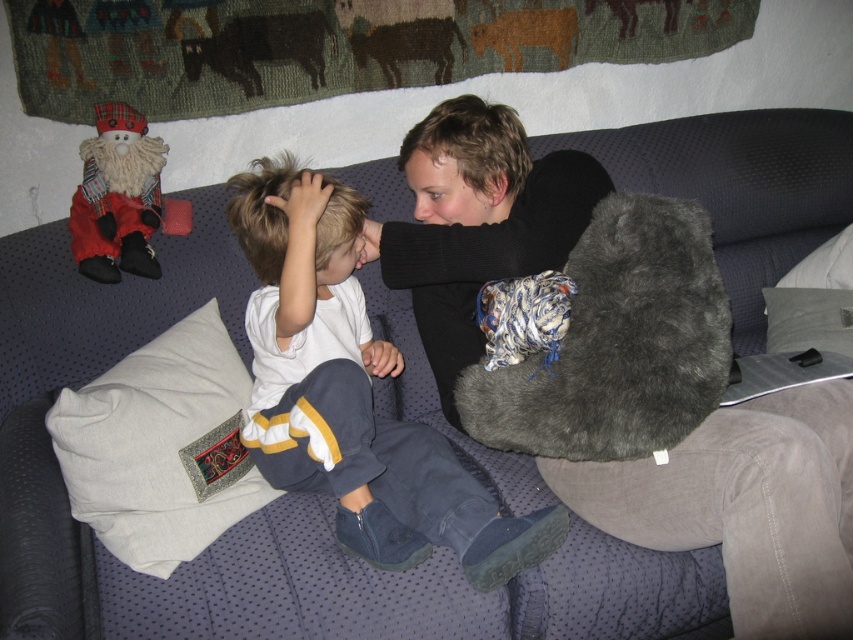
Question: Does fuzzy gray pillow at center lie behind white cotton pillow at lower left?

Choices:
 (A) yes
 (B) no

Answer: (B)

Question: Estimate the real-world distances between objects in this image. Which object is closer to the white cotton shirt at center?

Choices:
 (A) fuzzy gray pillow at center
 (B) fuzzy red santa at upper left

Answer: (A)

Question: Which point is farther from the camera taking this photo?

Choices:
 (A) (149, 532)
 (B) (695, 307)

Answer: (A)

Question: Observing the image, what is the correct spatial positioning of white cotton pillow at lower left in reference to fuzzy red santa at upper left?

Choices:
 (A) left
 (B) right

Answer: (B)

Question: Can you confirm if white cotton pillow at lower left is positioned to the right of brown wool cow at upper center?

Choices:
 (A) yes
 (B) no

Answer: (B)

Question: Which object is farther from the camera taking this photo?

Choices:
 (A) white cotton shirt at center
 (B) fuzzy red santa at upper left

Answer: (B)